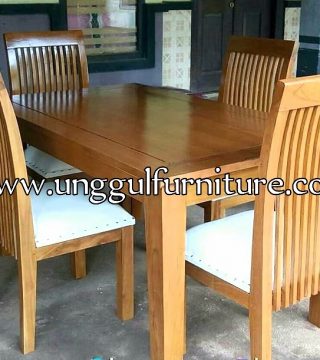
This screenshot has width=320, height=360. I want to click on table leg, so click(x=171, y=227).